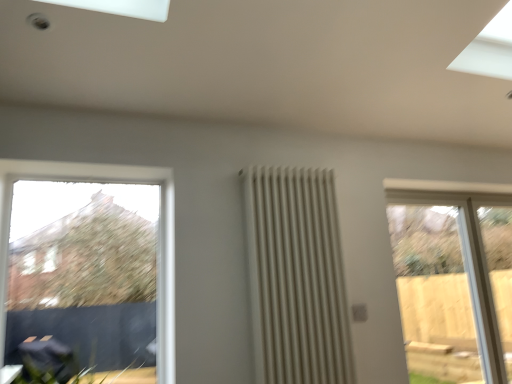
Question: From a real-world perspective, does white matte radiator at center stand above clear glass window at left, positioned as the 2th window in back-to-front order?

Choices:
 (A) no
 (B) yes

Answer: (A)

Question: Does white matte radiator at center turn towards clear glass window at left, marked as the first window in a left-to-right arrangement?

Choices:
 (A) no
 (B) yes

Answer: (A)

Question: Is white matte radiator at center at the right side of clear glass window at left, the 2th window when ordered from right to left?

Choices:
 (A) yes
 (B) no

Answer: (A)

Question: Is white matte radiator at center in front of clear glass window at left, the 2th window when ordered from right to left?

Choices:
 (A) yes
 (B) no

Answer: (B)

Question: Is white matte radiator at center beside clear glass window at left, marked as the first window in a left-to-right arrangement?

Choices:
 (A) yes
 (B) no

Answer: (B)

Question: Is clear glass door at right, the second window from the front, in front of or behind white matte radiator at center in the image?

Choices:
 (A) front
 (B) behind

Answer: (B)

Question: Is clear glass door at right, the first window positioned from the back, wider or thinner than white matte radiator at center?

Choices:
 (A) thin
 (B) wide

Answer: (B)

Question: Based on their sizes in the image, would you say clear glass door at right, marked as the first window in a right-to-left arrangement, is bigger or smaller than white matte radiator at center?

Choices:
 (A) big
 (B) small

Answer: (A)

Question: Considering the positions of clear glass door at right, the second window from the front, and white matte radiator at center in the image, is clear glass door at right, the second window from the front, taller or shorter than white matte radiator at center?

Choices:
 (A) tall
 (B) short

Answer: (A)

Question: From the image's perspective, is clear glass window at left, arranged as the first window when viewed from the front, located above or below clear glass door at right, the second window from the front?

Choices:
 (A) below
 (B) above

Answer: (B)

Question: From a real-world perspective, is clear glass window at left, the 2th window when ordered from right to left, physically located above or below clear glass door at right, marked as the first window in a right-to-left arrangement?

Choices:
 (A) below
 (B) above

Answer: (B)

Question: Is point (161, 170) positioned closer to the camera than point (460, 193)?

Choices:
 (A) farther
 (B) closer

Answer: (B)

Question: Is clear glass window at left, marked as the first window in a left-to-right arrangement, situated inside clear glass door at right, the second window from the front, or outside?

Choices:
 (A) inside
 (B) outside

Answer: (B)

Question: Is clear glass window at left, marked as the first window in a left-to-right arrangement, in front of or behind white matte radiator at center in the image?

Choices:
 (A) front
 (B) behind

Answer: (A)

Question: From a real-world perspective, is clear glass window at left, marked as the first window in a left-to-right arrangement, above or below white matte radiator at center?

Choices:
 (A) above
 (B) below

Answer: (A)